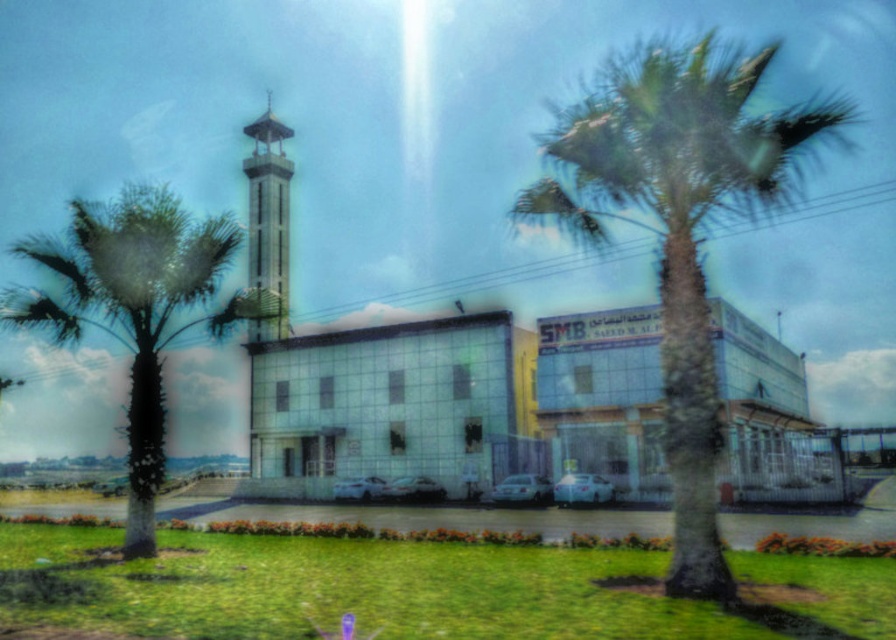
Question: Which of the following is the closest to the observer?

Choices:
 (A) satin silver car at center
 (B) green leafy palm tree at left

Answer: (B)

Question: Does silver metallic car at center have a lesser width compared to green matte car at center?

Choices:
 (A) yes
 (B) no

Answer: (A)

Question: Can you confirm if green leafy palm tree at center is positioned below white glass bell tower at center?

Choices:
 (A) no
 (B) yes

Answer: (A)

Question: Which object is positioned closest to the matte white car at center?

Choices:
 (A) green leafy palm tree at left
 (B) green leafy palm tree at center
 (C) white glass bell tower at center
 (D) white glossy car at center

Answer: (D)

Question: Does silver metallic car at center have a lesser width compared to white glossy car at center?

Choices:
 (A) no
 (B) yes

Answer: (B)

Question: Which of the following is the closest to the observer?

Choices:
 (A) (645, 58)
 (B) (366, 490)
 (C) (536, 484)

Answer: (A)